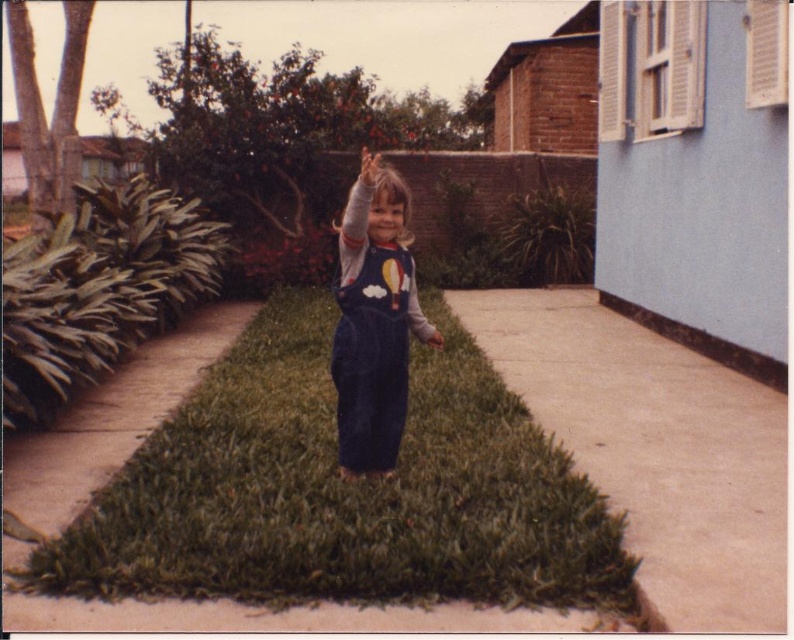
You are a delivery person who needs to walk from the building on the right to the triangular grass where the child is standing. The path you take must avoid the smooth concrete pavement at center. Which direction should you walk relative to the green grass at center?

You should walk to the right side of the green grass at center because the smooth concrete pavement at center is on its left, so avoiding the pavement means moving towards the right side of the grass.

You are a drone operator trying to capture a photo of the triangular grassy area. You need to ensure that both the point at (490,419) and the point at (644,504) are visible in the frame. Since you can only adjust the camera angle vertically, which point should you focus on to ensure both points are in the photo?

To ensure both points are visible, focus on the point that is closer to the camera, which is point (644,504), since it is behind point (490,419). By focusing on the farther point, you can adjust the angle to include the closer one in the frame.